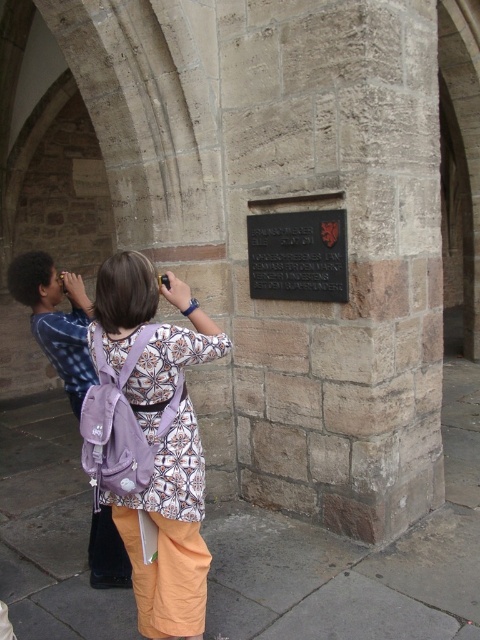
Question: Does purple fabric backpack at center have a smaller size compared to black polished stone plaque at center?

Choices:
 (A) no
 (B) yes

Answer: (A)

Question: Can you confirm if purple fabric backpack at center is positioned above blue plaid shirt at left?

Choices:
 (A) no
 (B) yes

Answer: (A)

Question: Which point is farther to the camera?

Choices:
 (A) black polished stone plaque at center
 (B) purple fabric backpack at center

Answer: (A)

Question: Does blue plaid shirt at left appear under black polished stone plaque at center?

Choices:
 (A) no
 (B) yes

Answer: (B)

Question: Among these objects, which one is nearest to the camera?

Choices:
 (A) purple fabric backpack at center
 (B) black polished stone plaque at center
 (C) blue plaid shirt at left

Answer: (A)

Question: Which of the following is the farthest from the observer?

Choices:
 (A) purple fabric backpack at center
 (B) blue plaid shirt at left

Answer: (B)